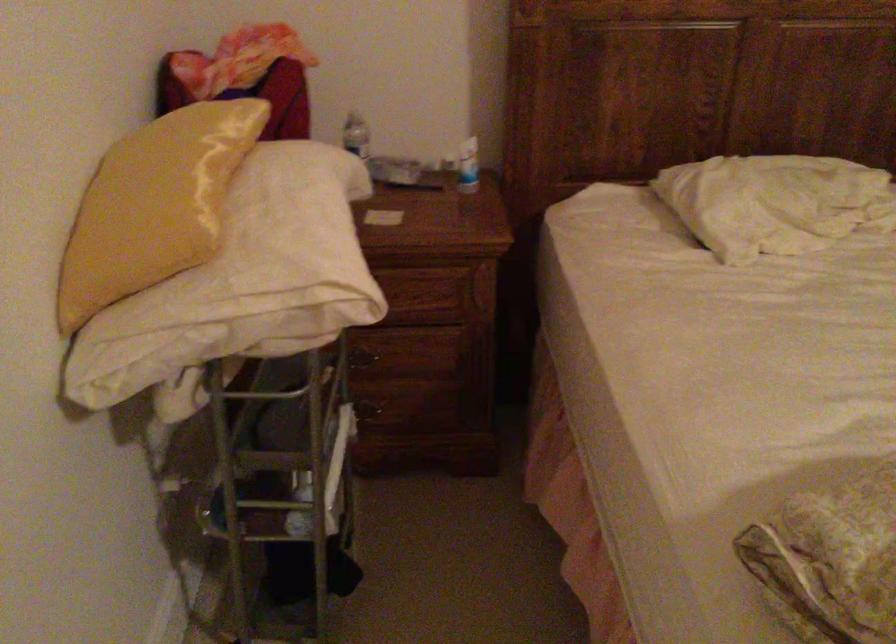
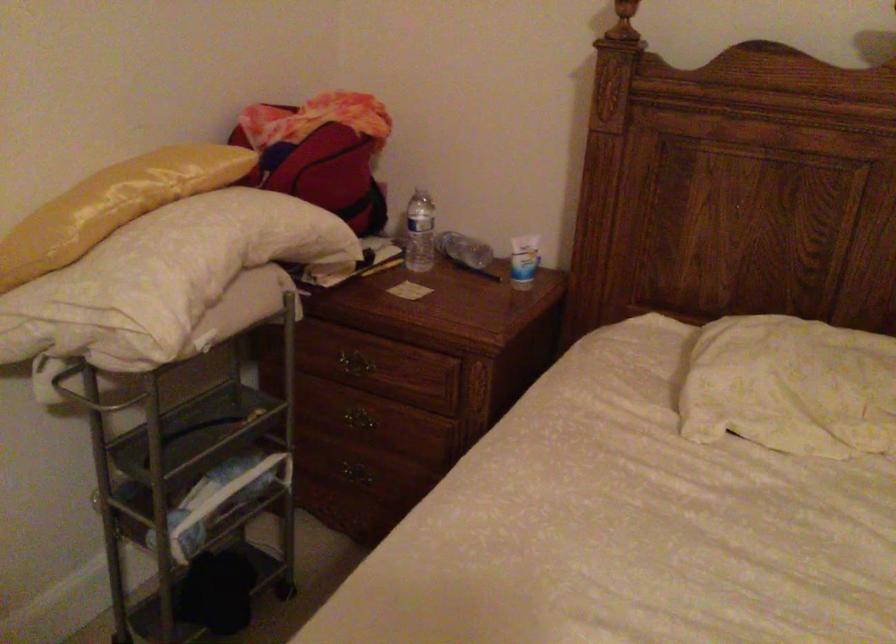
Find the pixel in the second image that matches (x=475, y=164) in the first image.

(523, 261)